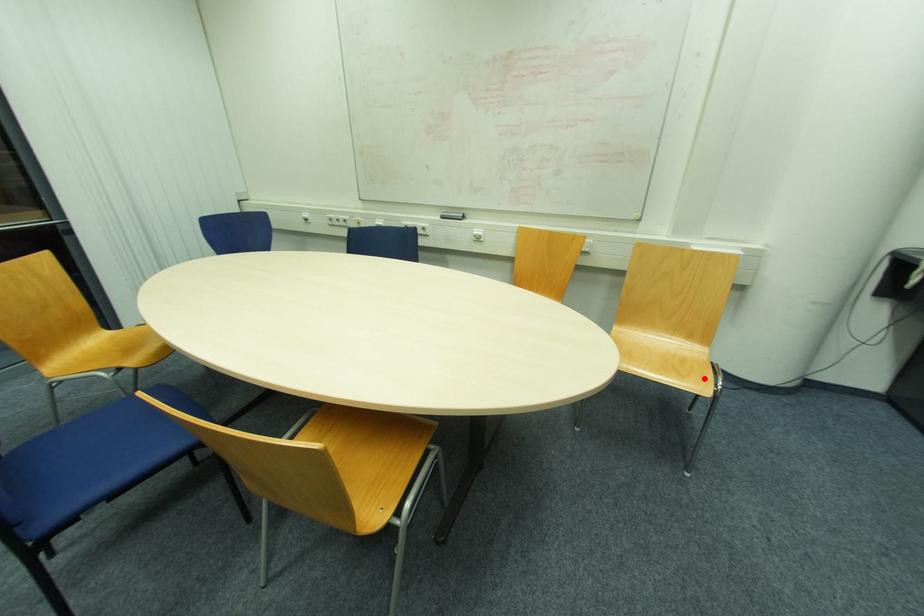
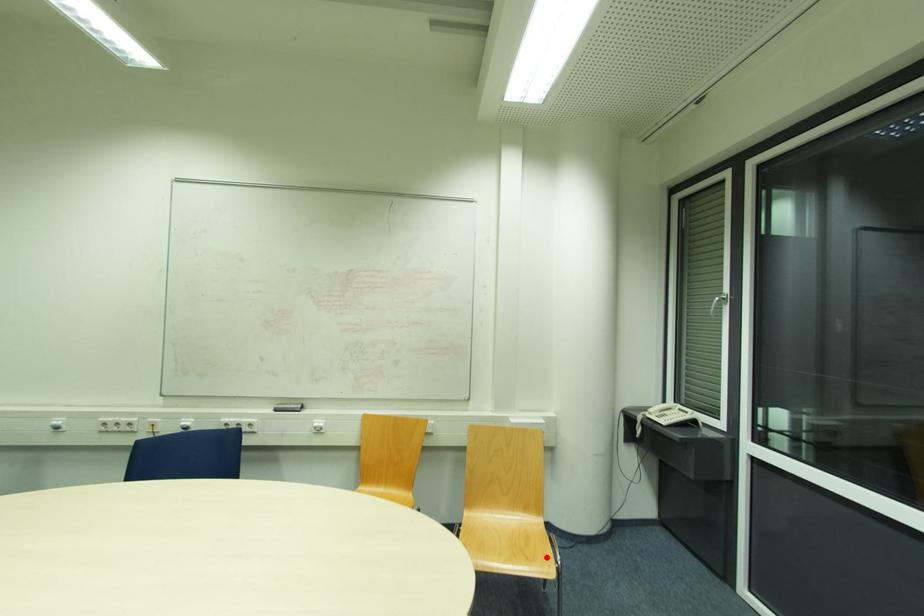
I am providing you with two images of the same scene from different viewpoints. A red point is marked on the first image and another point is marked on the second image. Are the points marked in image1 and image2 representing the same 3D position?

Yes